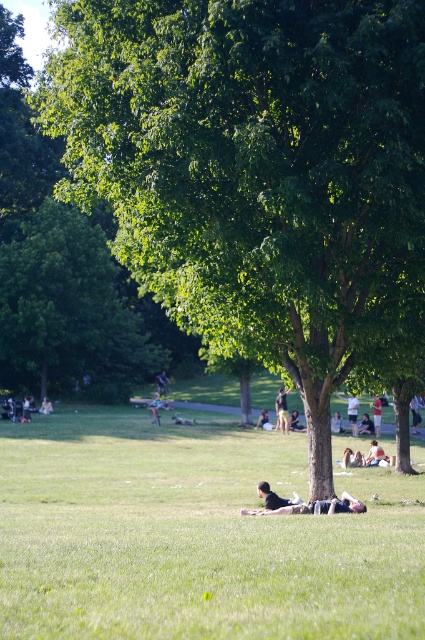
Is white cotton shirt at center above green fabric jacket at center?

Indeed, white cotton shirt at center is positioned over green fabric jacket at center.

The image size is (425, 640). What do you see at coordinates (376, 413) in the screenshot? I see `white cotton shirt at center` at bounding box center [376, 413].

Does point (376, 396) come behind point (152, 400)?

No, (376, 396) is in front of (152, 400).

The height and width of the screenshot is (640, 425). What are the coordinates of `white cotton shirt at center` in the screenshot? It's located at (376, 413).

Find the location of a particular element. white cotton shirt at center is located at coordinates (376, 413).

Looking at this image, does white cotton shirt at center have a greater width compared to dark blue shirt at center?

Correct, the width of white cotton shirt at center exceeds that of dark blue shirt at center.

Does point (379, 401) come in front of point (365, 433)?

Yes, it is in front of point (365, 433).

This screenshot has height=640, width=425. I want to click on white cotton shirt at center, so click(376, 413).

Measure the distance from light brown hair at center to dark blue jeans at center.

light brown hair at center is 17.56 meters from dark blue jeans at center.

Who is lower down, light brown hair at center or dark blue jeans at center?

light brown hair at center

Which is in front, point (368, 461) or point (337, 429)?

Point (368, 461) is in front.

At what (x,y) coordinates should I click in order to perform the action: click on light brown hair at center. Please return your answer as a coordinate pair (x, y). The image size is (425, 640). Looking at the image, I should click on (374, 452).